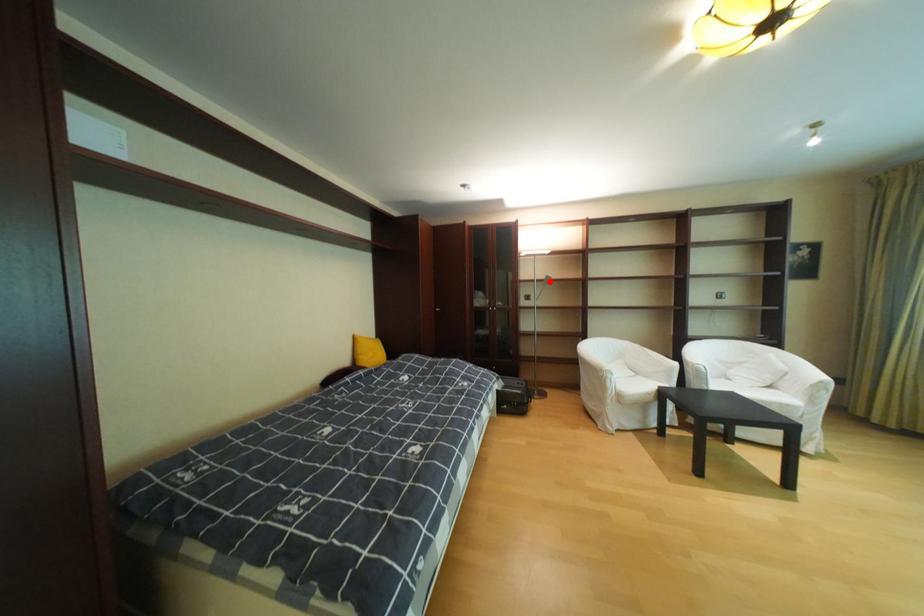
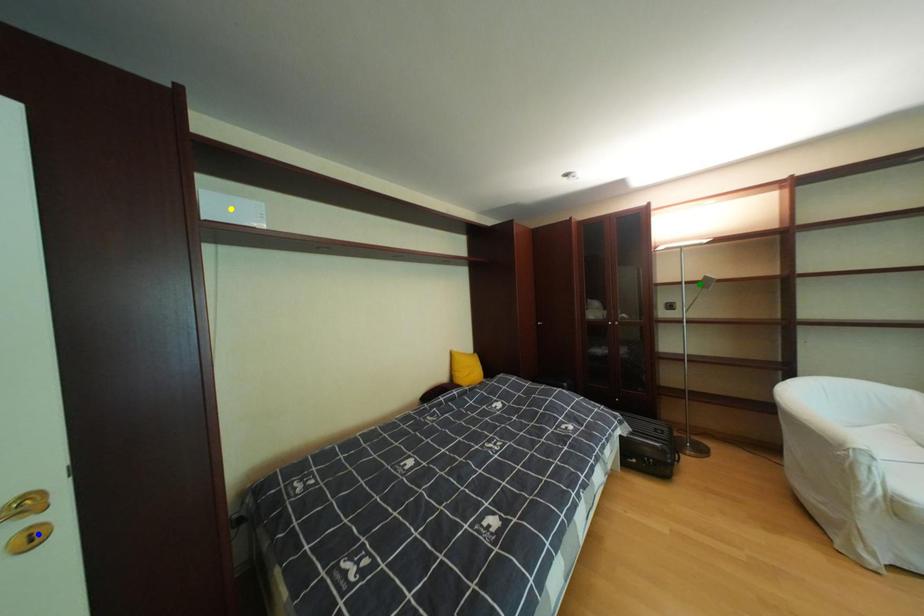
Question: I am providing you with two images of the same scene from different viewpoints. A red point is marked on the first image. You are given multiple points on the second image. Which mark in image 2 goes with the point in image 1?

Choices:
 (A) blue point
 (B) yellow point
 (C) green point

Answer: (C)